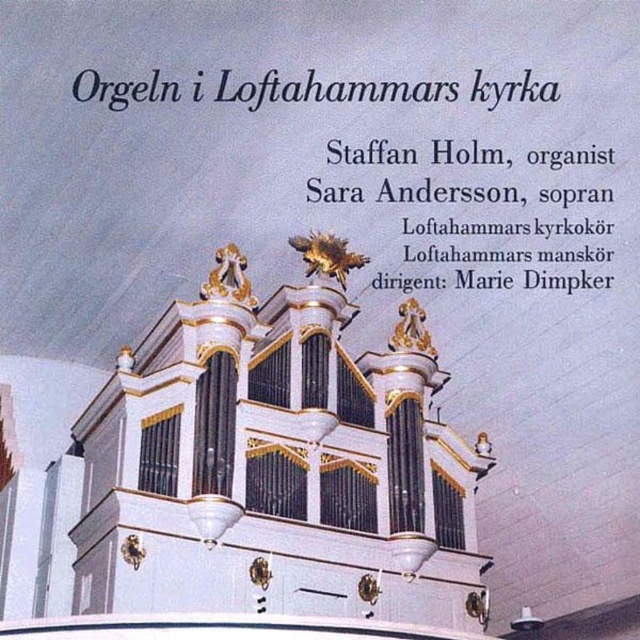
Is white polished wood organ at center above white paper at upper center?

Actually, white polished wood organ at center is below white paper at upper center.

Is white polished wood organ at center further to camera compared to white paper at upper center?

No, it is in front of white paper at upper center.

Between point (282, 525) and point (492, 86), which one is positioned in front?

Point (282, 525)

Identify the location of white polished wood organ at center. (276, 464).